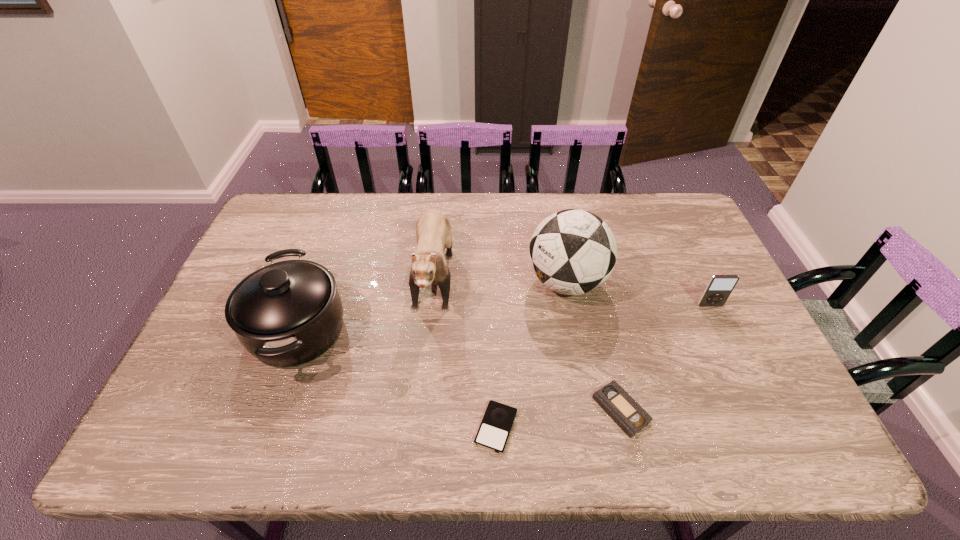
Find the location of a particular element. object that is at the right edge is located at coordinates (719, 287).

Find the location of a particular element. This screenshot has height=540, width=960. free space at the far edge of the desktop is located at coordinates (513, 194).

Locate an element on the screen. vacant space at the near edge of the desktop is located at coordinates (577, 426).

Identify the location of vacant space at the left edge of the desktop. (198, 362).

Identify the location of vacant point at the right edge. (737, 324).

In the image, there is a desktop. Where is `vacant area at the near left corner`? This screenshot has width=960, height=540. vacant area at the near left corner is located at coordinates (186, 429).

Locate an element on the screen. The width and height of the screenshot is (960, 540). free space at the far right corner of the desktop is located at coordinates (670, 208).

Where is `free area in between the second shortest object and the third object from left to right`? Image resolution: width=960 pixels, height=540 pixels. free area in between the second shortest object and the third object from left to right is located at coordinates (559, 418).

I want to click on vacant space that is in between the shortest object and the fifth object from right to left, so click(466, 347).

Image resolution: width=960 pixels, height=540 pixels. I want to click on free space that is in between the nearer iPod and the taller iPod, so (x=603, y=366).